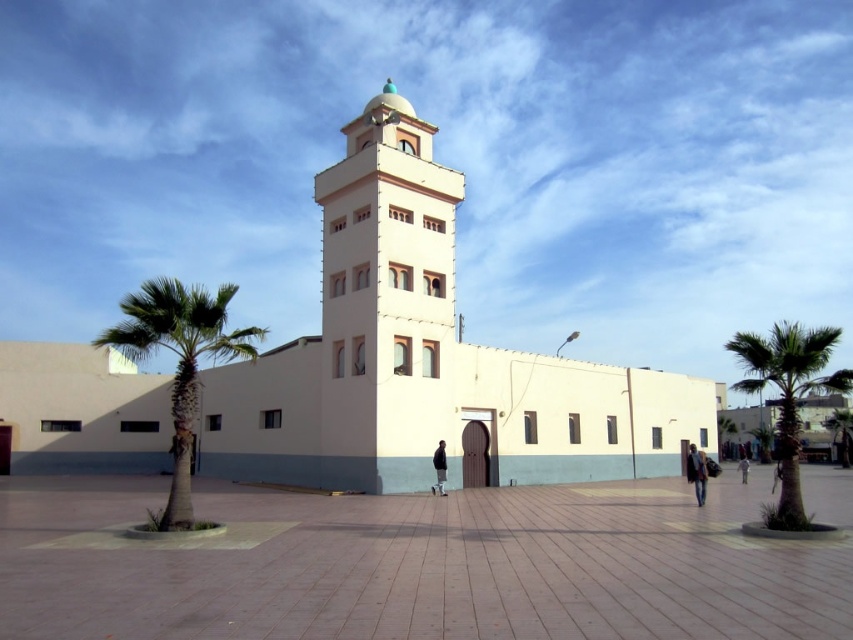
Question: Which is nearer to the light pink stucco bell tower at center?

Choices:
 (A) light blue jeans at center
 (B) dark gray jacket at center
 (C) green leafy palm tree at right
 (D) green leafy palm tree at left

Answer: (B)

Question: Is green leafy palm tree at right thinner than dark blue fabric jacket at lower right?

Choices:
 (A) yes
 (B) no

Answer: (B)

Question: Does dark blue fabric jacket at lower right appear on the right side of light blue jeans at center?

Choices:
 (A) yes
 (B) no

Answer: (B)

Question: Which object appears closest to the camera in this image?

Choices:
 (A) green leafy palm tree at right
 (B) dark gray jacket at center
 (C) light pink stucco bell tower at center

Answer: (A)

Question: Can you confirm if dark blue fabric jacket at lower right is bigger than dark gray jacket at center?

Choices:
 (A) yes
 (B) no

Answer: (A)

Question: Which point is closer to the camera?

Choices:
 (A) (445, 493)
 (B) (706, 467)
 (C) (131, 321)

Answer: (C)